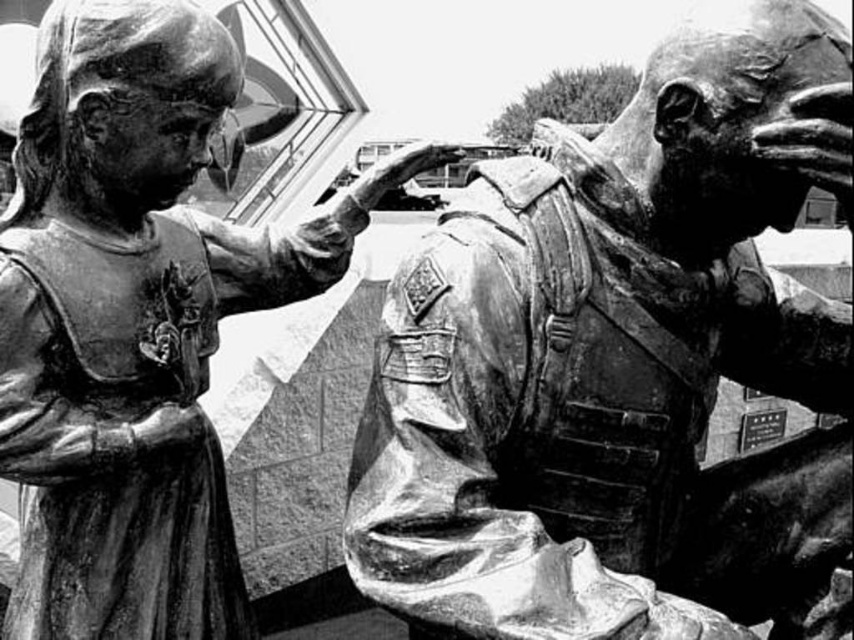
Question: Can you confirm if bronze soldier at center is smaller than bronze statue at center?

Choices:
 (A) yes
 (B) no

Answer: (B)

Question: Which point appears closest to the camera in this image?

Choices:
 (A) (560, 467)
 (B) (74, 44)

Answer: (B)

Question: Does bronze soldier at center appear on the right side of bronze statue at center?

Choices:
 (A) yes
 (B) no

Answer: (A)

Question: Does bronze soldier at center appear under bronze statue at center?

Choices:
 (A) yes
 (B) no

Answer: (A)

Question: Among these points, which one is nearest to the camera?

Choices:
 (A) (179, 250)
 (B) (787, 371)

Answer: (A)